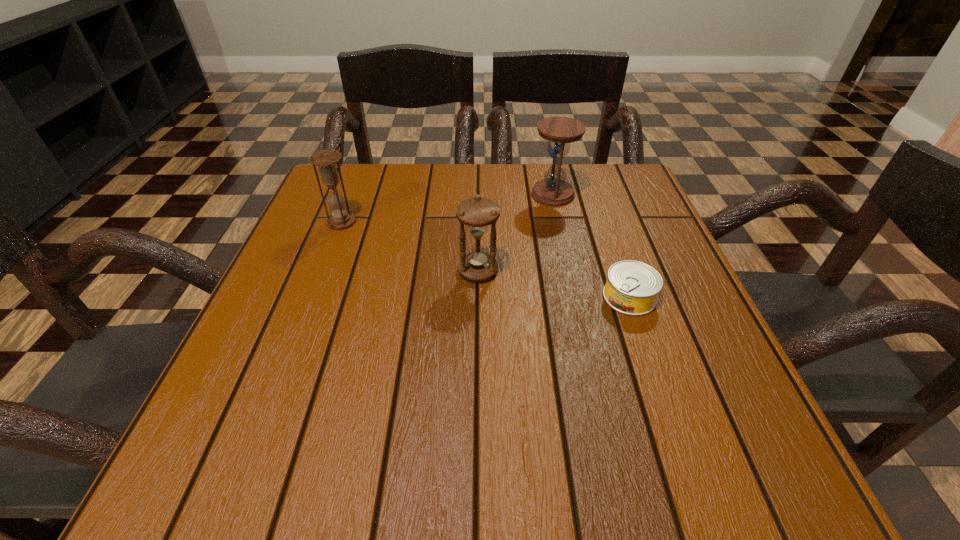
Locate an element on the screen. This screenshot has height=540, width=960. vacant space that satisfies the following two spatial constraints: 1. on the front side of the shortest object; 2. on the left side of the farthest object is located at coordinates (576, 297).